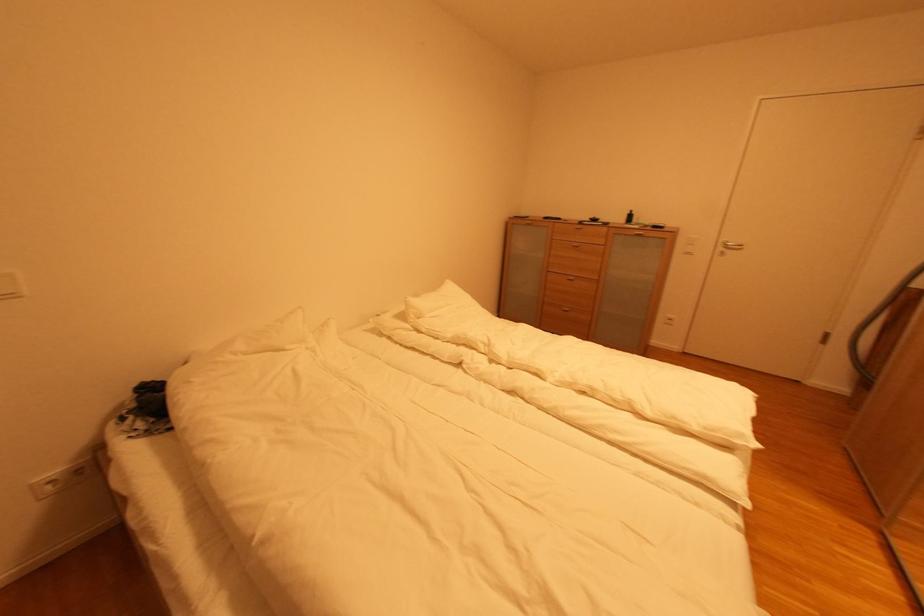
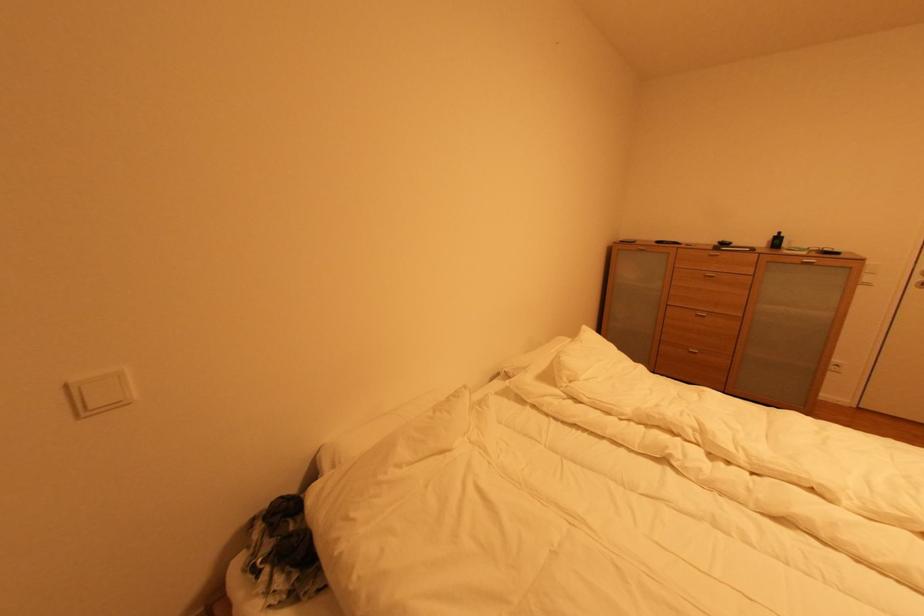
Question: The images are taken continuously from a first-person perspective. In which direction is your viewpoint rotating?

Choices:
 (A) Left
 (B) Right
 (C) Up
 (D) Down

Answer: (A)